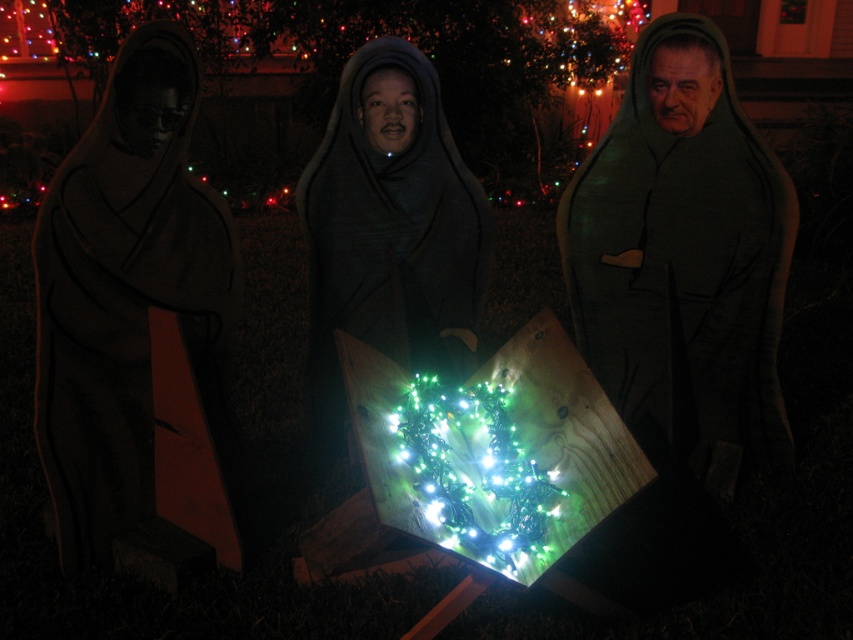
Question: Which of the following is the closest to the observer?

Choices:
 (A) green string lights at center
 (B) dark matte robe at center
 (C) matte black robe at center
 (D) black matte robe at left

Answer: (A)

Question: Can you confirm if black matte robe at left is positioned below dark matte robe at center?

Choices:
 (A) no
 (B) yes

Answer: (B)

Question: Among these objects, which one is nearest to the camera?

Choices:
 (A) black matte robe at left
 (B) dark matte robe at center
 (C) matte black robe at center
 (D) green string lights at center

Answer: (D)

Question: Is black matte robe at left positioned before matte black robe at center?

Choices:
 (A) yes
 (B) no

Answer: (A)

Question: Does black matte robe at left have a larger size compared to dark matte robe at center?

Choices:
 (A) no
 (B) yes

Answer: (A)

Question: Based on their relative distances, which object is nearer to the green string lights at center?

Choices:
 (A) dark matte robe at center
 (B) black matte robe at left
 (C) matte black robe at center

Answer: (C)